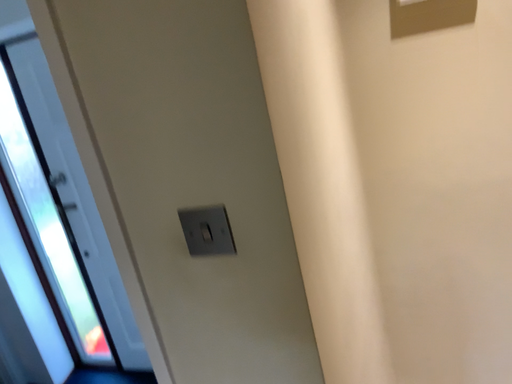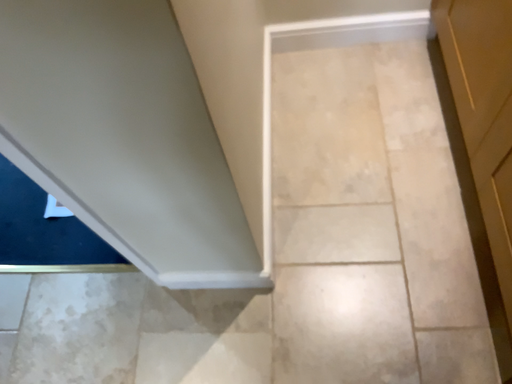
Question: How did the camera likely rotate when shooting the video?

Choices:
 (A) rotated right
 (B) rotated left

Answer: (A)